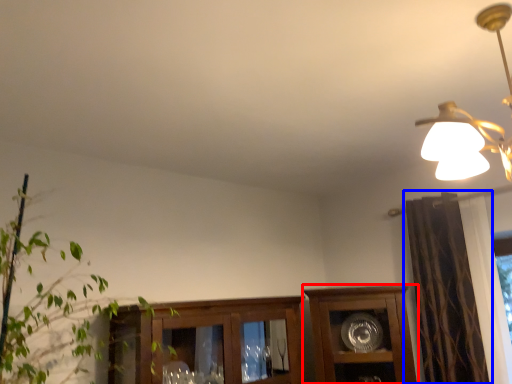
Question: Which object is further to the camera taking this photo, cabinetry (highlighted by a red box) or curtain (highlighted by a blue box)?

Choices:
 (A) cabinetry
 (B) curtain

Answer: (A)